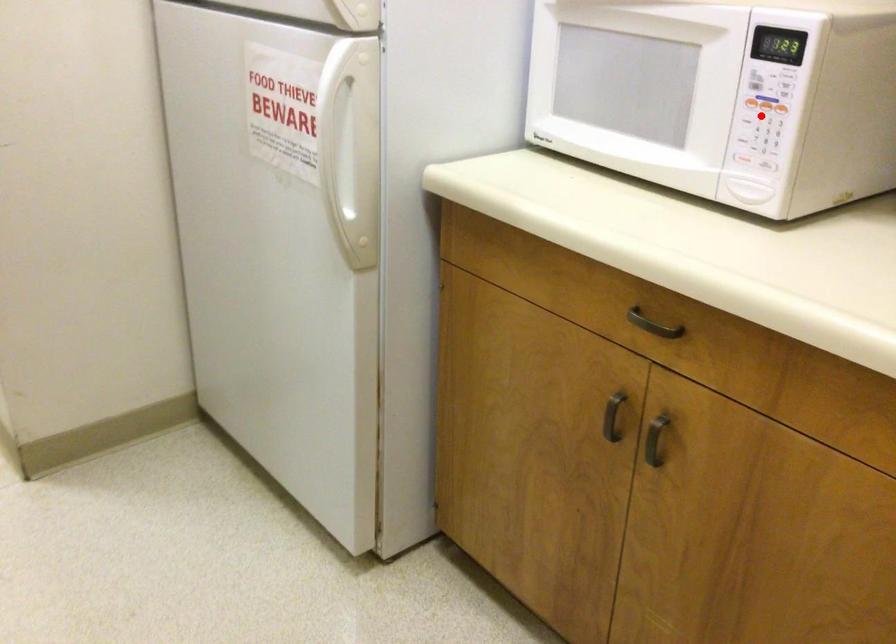
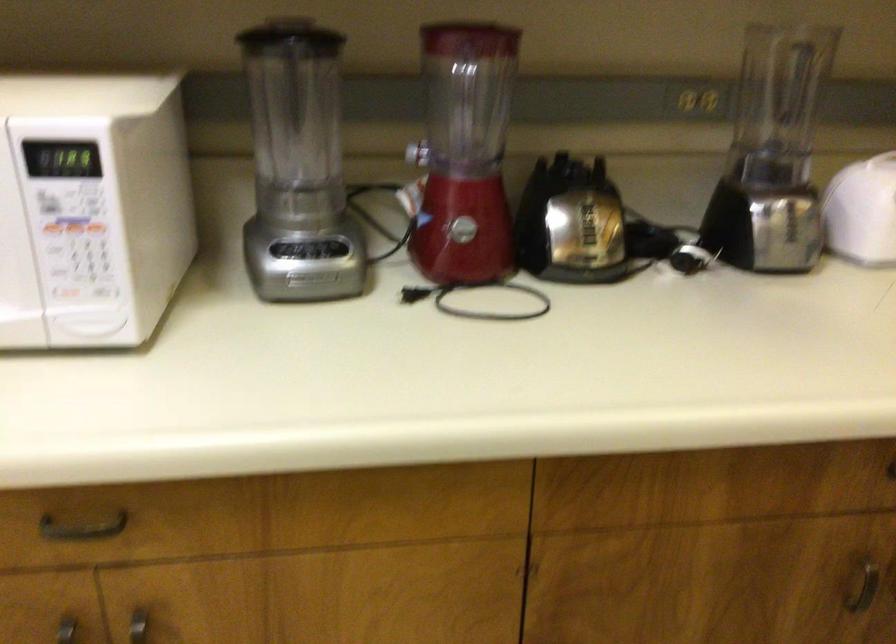
Locate, in the second image, the point that corresponds to the highlighted location in the first image.

(74, 242)